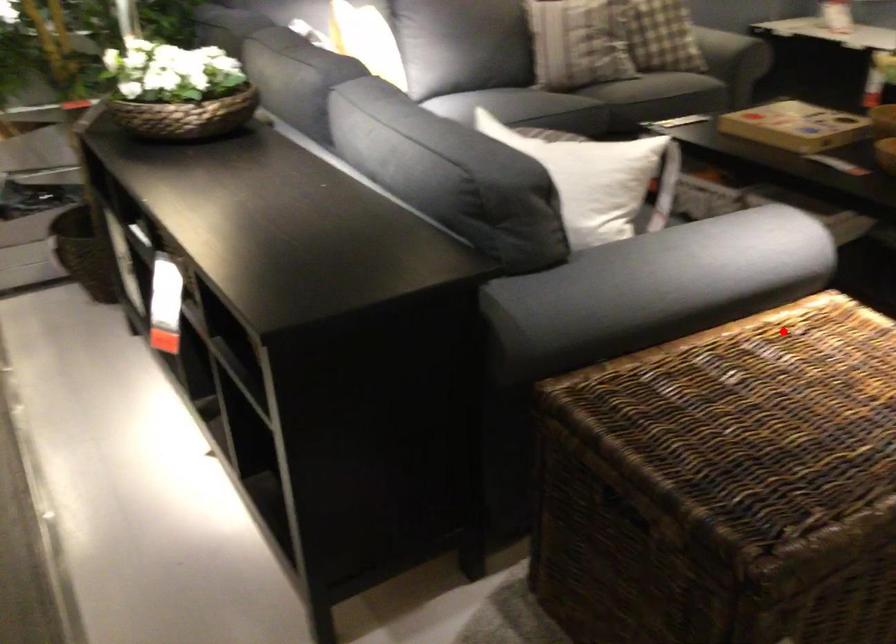
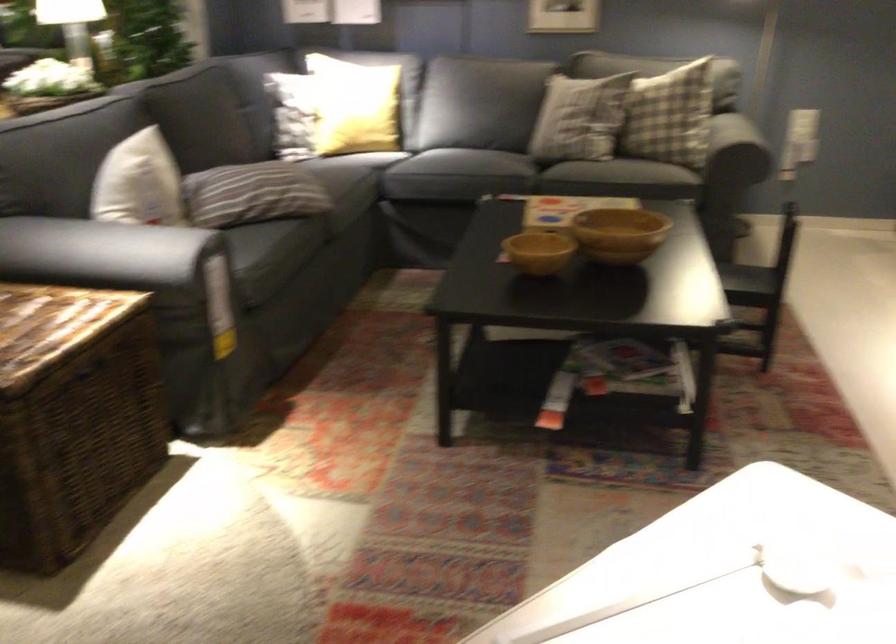
The point at the highlighted location is marked in the first image. Where is the corresponding point in the second image?

(55, 317)